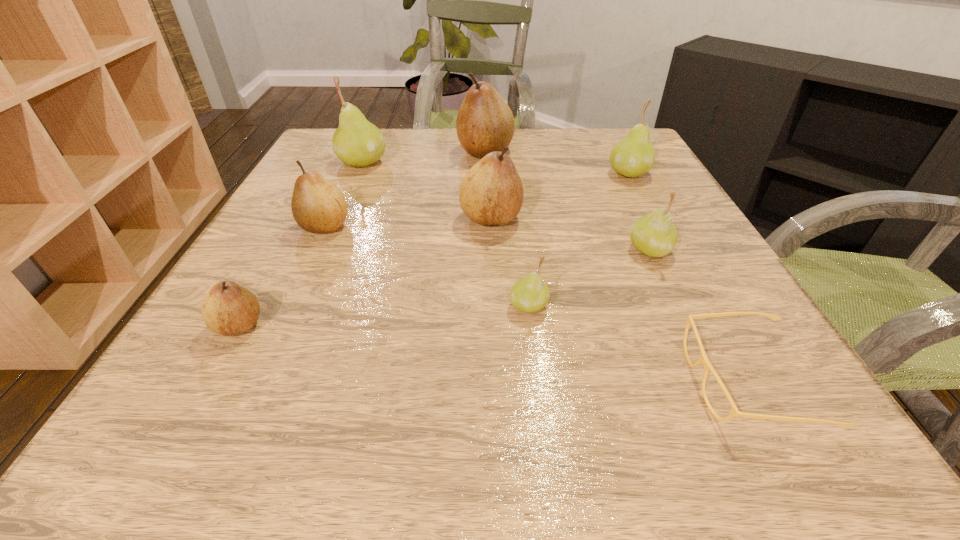
Identify the location of spectacles. (703, 358).

Where is `vacant space located 0.130m on the left of the farthest brown pear`? The height and width of the screenshot is (540, 960). vacant space located 0.130m on the left of the farthest brown pear is located at coordinates (405, 152).

This screenshot has width=960, height=540. I want to click on vacant area located 0.060m on the front of the leftmost green pear, so click(x=351, y=187).

At what (x,y) coordinates should I click in order to perform the action: click on vacant space located 0.060m on the front of the second biggest green pear. Please return your answer as a coordinate pair (x, y). Looking at the image, I should click on (641, 198).

I want to click on free space located 0.300m on the left of the second biggest brown pear, so click(x=310, y=218).

Locate an element on the screen. This screenshot has height=540, width=960. vacant point located 0.160m on the right of the third biggest brown pear is located at coordinates (432, 226).

Locate an element on the screen. This screenshot has height=540, width=960. vacant space located 0.140m on the front of the second nearest green pear is located at coordinates (684, 322).

Where is `vacant space located on the back of the second green pear from left to right`? vacant space located on the back of the second green pear from left to right is located at coordinates (516, 202).

Where is `free space located on the back of the nearest brown pear`? The width and height of the screenshot is (960, 540). free space located on the back of the nearest brown pear is located at coordinates (302, 212).

Where is `free space located 0.130m in front of the lenses of the beige spectacles`? The width and height of the screenshot is (960, 540). free space located 0.130m in front of the lenses of the beige spectacles is located at coordinates (596, 382).